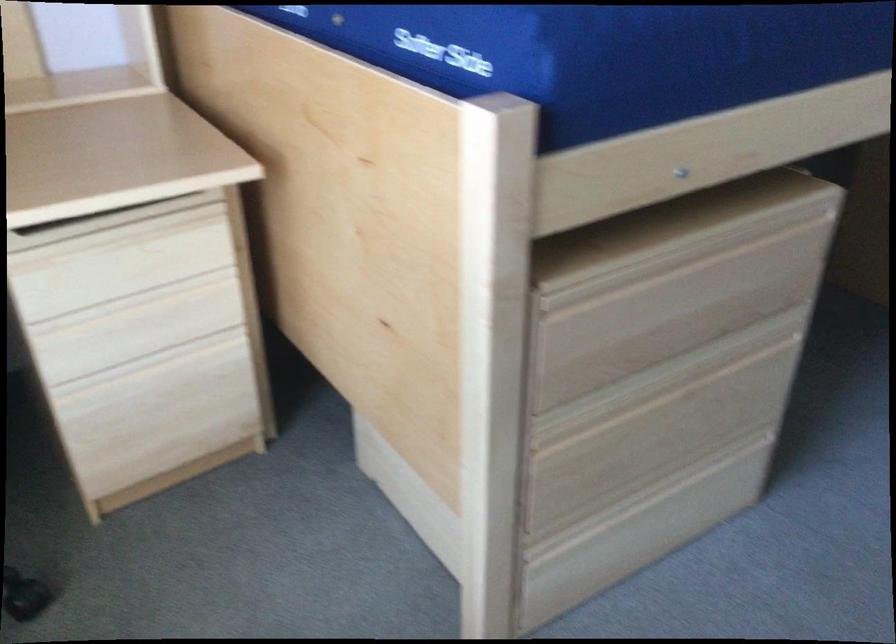
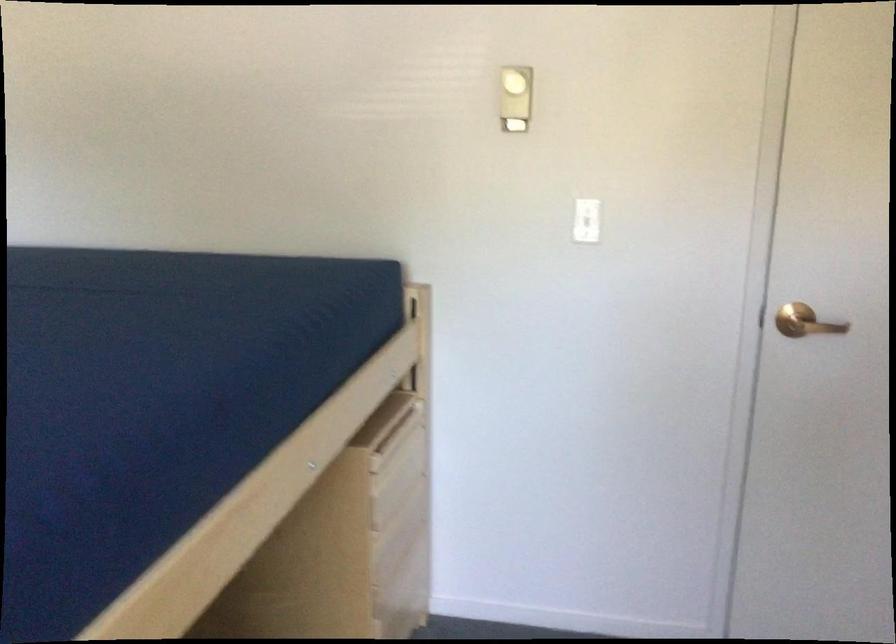
Question: How did the camera likely rotate?

Choices:
 (A) Left
 (B) Right
 (C) Up
 (D) Down

Answer: (B)